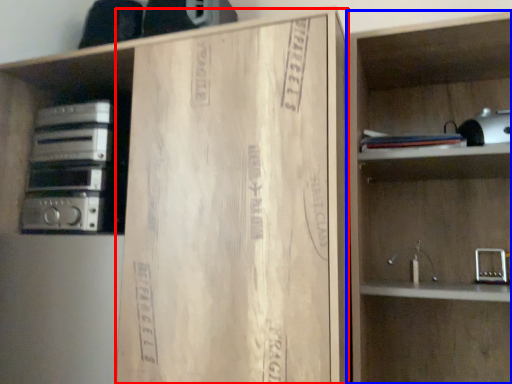
Question: Which point is closer to the camera, cardboard (highlighted by a red box) or shelf (highlighted by a blue box)?

Choices:
 (A) cardboard
 (B) shelf

Answer: (A)